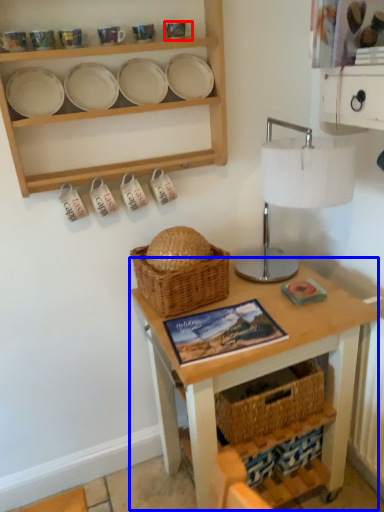
Question: Which object appears closest to the camera in this image, tableware (highlighted by a red box) or table (highlighted by a blue box)?

Choices:
 (A) tableware
 (B) table

Answer: (B)